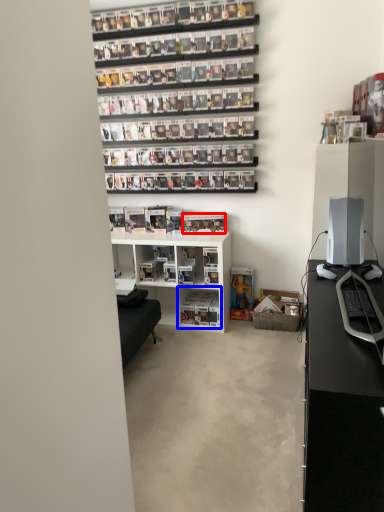
Question: Which object is closer to the camera taking this photo, book (highlighted by a red box) or shelf (highlighted by a blue box)?

Choices:
 (A) book
 (B) shelf

Answer: (B)